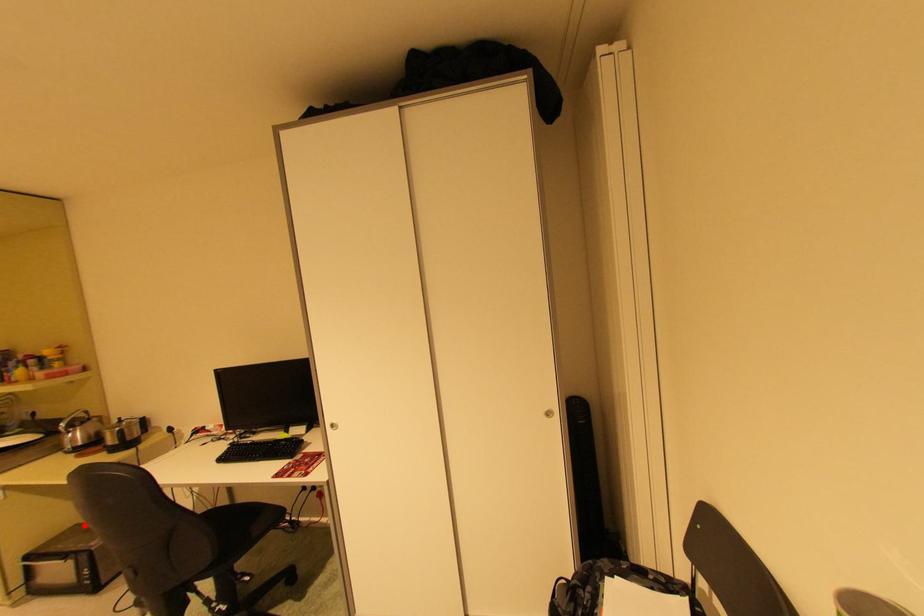
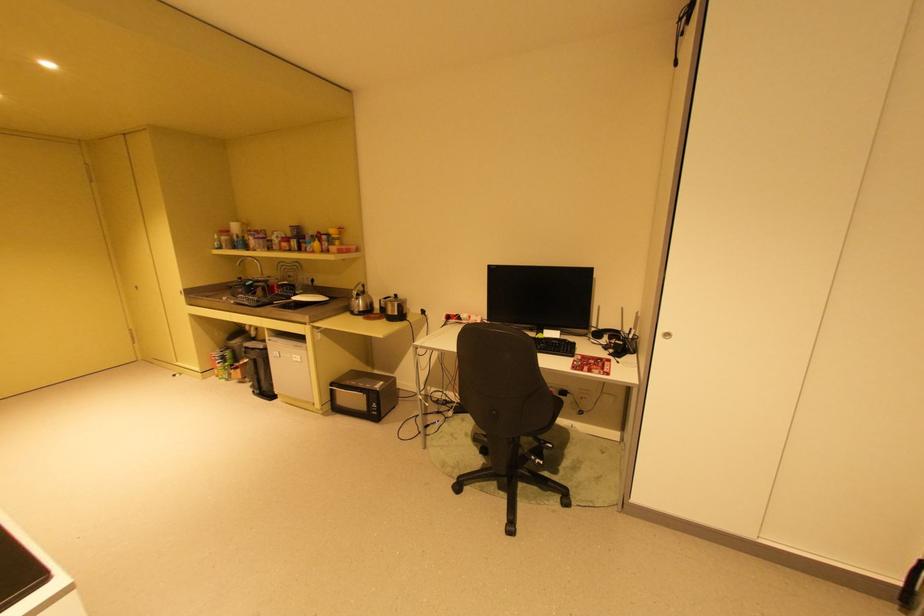
Question: A red point is marked in image1. In image2, is the corresponding 3D point closer to the camera or farther? Reply with the corresponding letter.

Choices:
 (A) The corresponding 3D point is closer.
 (B) The corresponding 3D point is farther.

Answer: (B)